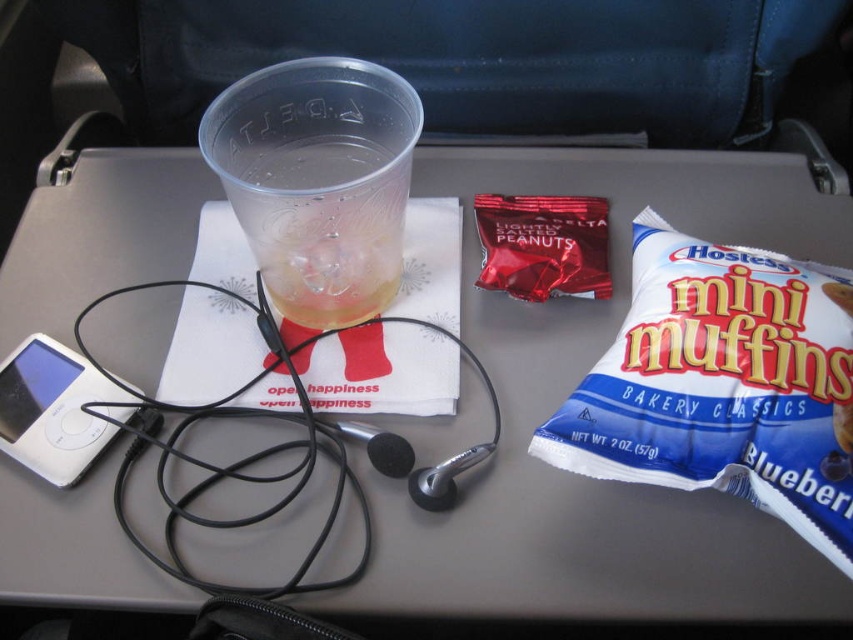
You are a flight attendant checking the items on the tray table. You need to place a new item at the exact location marked by point (318, 180). What item is currently occupying that spot?

The transparent plastic cup at upper center is occupying the location marked by point (318, 180).

Consider the image. You are a flight attendant checking the items on the tray table. You need to place a new item between the transparent plastic cup at upper center and the shiny red peanuts at center. Based on their current positions, which object should you place the new item closer to?

The new item should be placed closer to the shiny red peanuts at center because the transparent plastic cup at upper center is positioned on the left side of shiny red peanuts at center, meaning there is space to the right of the cup towards the peanuts.

Based on the photo, you are sitting in an airplane seat and looking at the tray table. There are two points marked on the tray table. One is at point (x=641, y=234) and the other is at point (x=331, y=193). Which point is closer to you?

Point (x=331, y=193) is closer to you because it is in front of point (x=641, y=234).